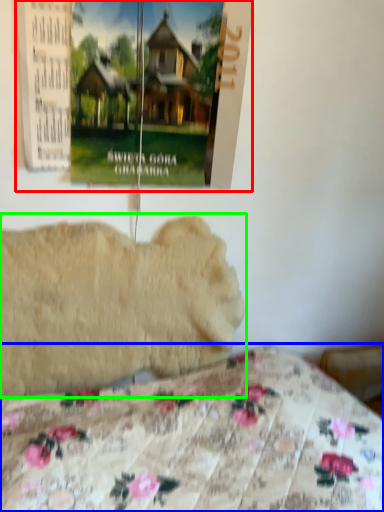
Question: Which object is the closest to the poster page (highlighted by a red box)? Choose among these: bed (highlighted by a blue box) or animal (highlighted by a green box).

Choices:
 (A) bed
 (B) animal

Answer: (B)